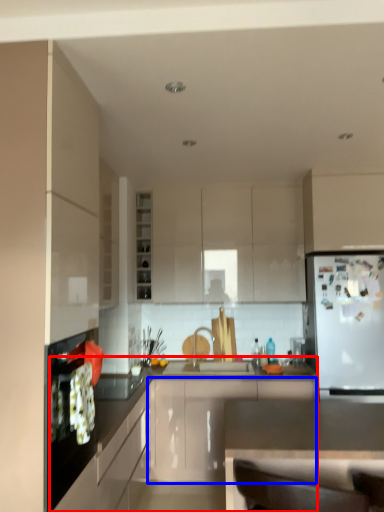
Question: Which object appears farthest to the camera in this image, countertop (highlighted by a red box) or cabinetry (highlighted by a blue box)?

Choices:
 (A) countertop
 (B) cabinetry

Answer: (B)